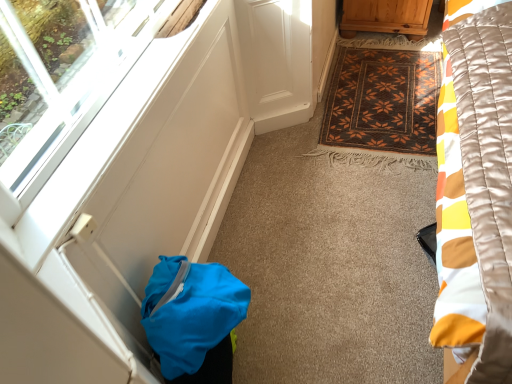
Question: Considering the relative sizes of brown woven mat at center and transparent glass window at lower left in the image provided, is brown woven mat at center wider than transparent glass window at lower left?

Choices:
 (A) no
 (B) yes

Answer: (B)

Question: Considering the relative sizes of brown woven mat at center and transparent glass window at lower left in the image provided, is brown woven mat at center smaller than transparent glass window at lower left?

Choices:
 (A) no
 (B) yes

Answer: (A)

Question: Can you confirm if brown woven mat at center is positioned to the left of transparent glass window at lower left?

Choices:
 (A) no
 (B) yes

Answer: (A)

Question: Does brown woven mat at center have a lesser height compared to transparent glass window at lower left?

Choices:
 (A) yes
 (B) no

Answer: (B)

Question: Does brown woven mat at center lie in front of transparent glass window at lower left?

Choices:
 (A) yes
 (B) no

Answer: (B)

Question: Is brown woven mat at center located outside transparent glass window at lower left?

Choices:
 (A) yes
 (B) no

Answer: (A)

Question: Is blue fabric bag at lower left thinner than transparent glass window at lower left?

Choices:
 (A) no
 (B) yes

Answer: (A)

Question: Considering the relative sizes of blue fabric bag at lower left and transparent glass window at lower left in the image provided, is blue fabric bag at lower left bigger than transparent glass window at lower left?

Choices:
 (A) no
 (B) yes

Answer: (B)

Question: Considering the relative sizes of blue fabric bag at lower left and transparent glass window at lower left in the image provided, is blue fabric bag at lower left wider than transparent glass window at lower left?

Choices:
 (A) no
 (B) yes

Answer: (B)

Question: Can we say blue fabric bag at lower left lies outside transparent glass window at lower left?

Choices:
 (A) yes
 (B) no

Answer: (A)

Question: Is blue fabric bag at lower left taller than transparent glass window at lower left?

Choices:
 (A) yes
 (B) no

Answer: (A)

Question: From a real-world perspective, is blue fabric bag at lower left on transparent glass window at lower left?

Choices:
 (A) no
 (B) yes

Answer: (A)

Question: From the image's perspective, is brown woven mat at center below wooden cabinet at upper right?

Choices:
 (A) yes
 (B) no

Answer: (A)